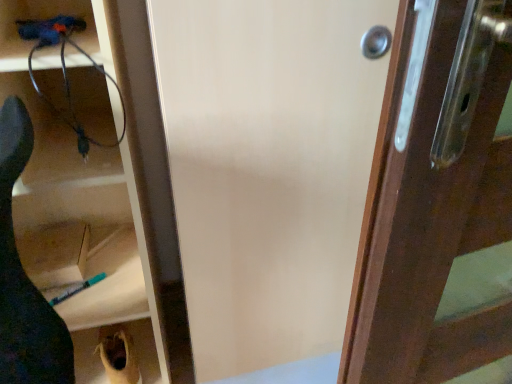
Question: Is matte wood screen door at center next to black matte shoe at lower left and touching it?

Choices:
 (A) no
 (B) yes

Answer: (A)

Question: Can you confirm if matte wood screen door at center is thinner than black matte shoe at lower left?

Choices:
 (A) yes
 (B) no

Answer: (B)

Question: Can we say matte wood screen door at center lies outside black matte shoe at lower left?

Choices:
 (A) yes
 (B) no

Answer: (A)

Question: Is matte wood screen door at center at the right side of black matte shoe at lower left?

Choices:
 (A) no
 (B) yes

Answer: (B)

Question: Is black matte shoe at lower left at the back of matte wood screen door at center?

Choices:
 (A) yes
 (B) no

Answer: (B)

Question: Is matte wood screen door at center at the left side of black matte shoe at lower left?

Choices:
 (A) no
 (B) yes

Answer: (A)

Question: Is matte plastic cabinet at left, marked as the 1th cabinetry in a top-to-bottom arrangement, taller than matte wood screen door at center?

Choices:
 (A) no
 (B) yes

Answer: (A)

Question: Is matte plastic cabinet at left, acting as the second cabinetry starting from the bottom, not close to matte wood screen door at center?

Choices:
 (A) yes
 (B) no

Answer: (B)

Question: Is matte plastic cabinet at left, marked as the 1th cabinetry in a top-to-bottom arrangement, closer to camera compared to matte wood screen door at center?

Choices:
 (A) yes
 (B) no

Answer: (B)

Question: Can you confirm if matte plastic cabinet at left, acting as the second cabinetry starting from the bottom, is smaller than matte wood screen door at center?

Choices:
 (A) no
 (B) yes

Answer: (B)

Question: From a real-world perspective, is matte plastic cabinet at left, marked as the 1th cabinetry in a top-to-bottom arrangement, beneath matte wood screen door at center?

Choices:
 (A) yes
 (B) no

Answer: (A)

Question: Can matte wood screen door at center be found inside matte plastic cabinet at left, acting as the second cabinetry starting from the bottom?

Choices:
 (A) no
 (B) yes

Answer: (A)

Question: From the image's perspective, is matte plastic cabinet at left, marked as the 1th cabinetry in a top-to-bottom arrangement, located beneath dark brown wood at right?

Choices:
 (A) no
 (B) yes

Answer: (A)